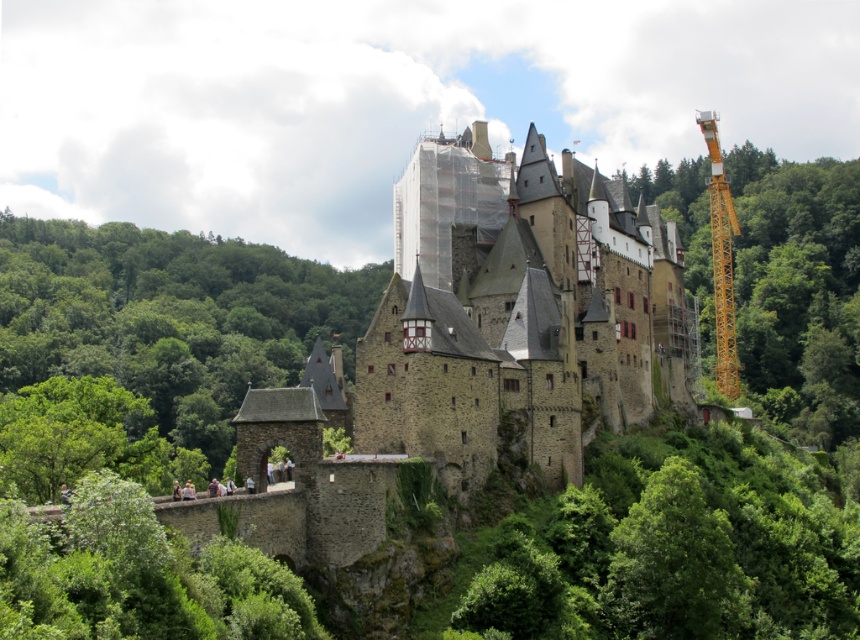
Does green leafy tree at right appear over yellow metallic crane at right?

No, green leafy tree at right is not above yellow metallic crane at right.

Is green leafy tree at right shorter than yellow metallic crane at right?

Indeed, green leafy tree at right has a lesser height compared to yellow metallic crane at right.

Between point (771, 186) and point (713, 259), which one is positioned behind?

Positioned behind is point (771, 186).

The height and width of the screenshot is (640, 860). What are the coordinates of `green leafy tree at right` in the screenshot? It's located at (797, 291).

Can you confirm if green leafy tree at lower left is positioned below green leafy tree at right?

Indeed, green leafy tree at lower left is positioned under green leafy tree at right.

Which is above, green leafy tree at lower left or green leafy tree at right?

green leafy tree at right is above.

Between point (77, 394) and point (794, 211), which one is positioned in front?

Point (77, 394) is in front.

Find the location of a particular element. The height and width of the screenshot is (640, 860). green leafy tree at lower left is located at coordinates (148, 346).

Can you confirm if green leafy tree at lower left is thinner than green leafy tree at center?

No, green leafy tree at lower left is not thinner than green leafy tree at center.

Can you confirm if green leafy tree at lower left is positioned to the right of green leafy tree at center?

No, green leafy tree at lower left is not to the right of green leafy tree at center.

Identify the location of green leafy tree at lower left. The width and height of the screenshot is (860, 640). (148, 346).